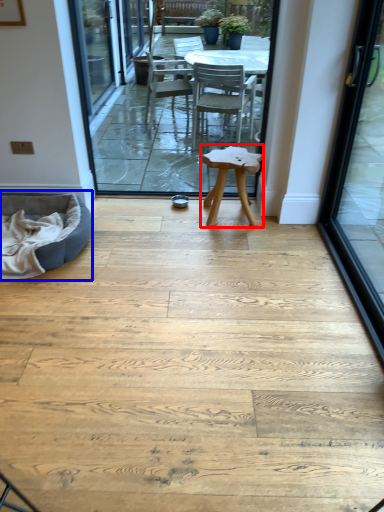
Question: Which object appears farthest to the camera in this image, stool (highlighted by a red box) or bean bag chair (highlighted by a blue box)?

Choices:
 (A) stool
 (B) bean bag chair

Answer: (A)